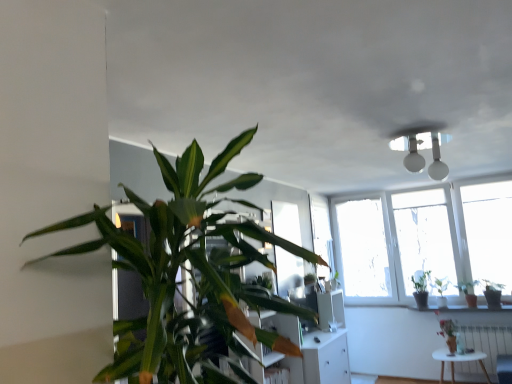
Question: From a real-world perspective, is green glossy plant at right, the sixth houseplant positioned from the front, above or below green glossy plant at right, which is the third houseplant in front-to-back order?

Choices:
 (A) below
 (B) above

Answer: (B)

Question: In the image, is green glossy plant at right, positioned as the fifth houseplant in right-to-left order, on the left side or the right side of green glossy plant at right, arranged as the sixth houseplant when viewed from the left?

Choices:
 (A) left
 (B) right

Answer: (A)

Question: Which object is the farthest from the green glossy plant at right, which is the third houseplant in front-to-back order?

Choices:
 (A) green glossy houseplant at lower right, which is counted as the 4th houseplant, starting from the right
 (B) white metallic radiator at lower right
 (C) green leafy plant at left, which is counted as the 6th houseplant, starting from the right
 (D) green glossy plant at upper right, which ranks as the 3th houseplant in right-to-left order
 (E) green glossy plant at right, the fifth houseplant viewed from the left

Answer: (C)

Question: Considering the real-world distances, which object is closest to the green glossy plant at right, which ranks as the second houseplant in right-to-left order?

Choices:
 (A) green glossy plant at right, arranged as the sixth houseplant when viewed from the left
 (B) white metallic radiator at lower right
 (C) white matte table at lower right
 (D) green glossy plant at right, acting as the first houseplant starting from the back
 (E) green leafy plant at left, the 1th houseplant viewed from the left

Answer: (A)